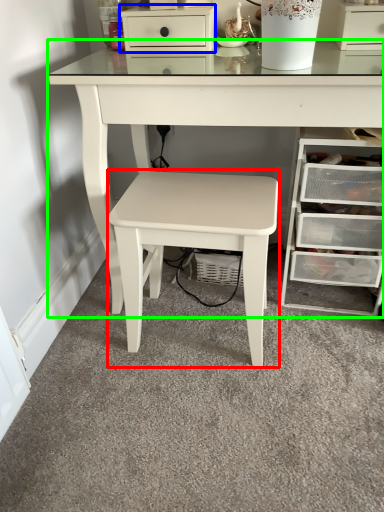
Question: Which is nearer to the stool (highlighted by a red box)? chest of drawers (highlighted by a blue box) or table (highlighted by a green box).

Choices:
 (A) chest of drawers
 (B) table

Answer: (B)